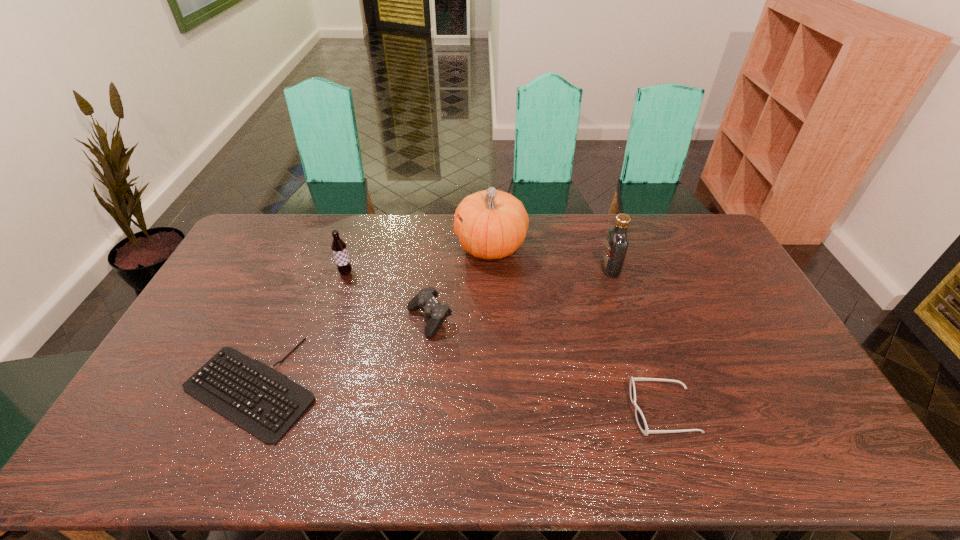
I want to click on free space located 0.270m on the front-facing side of the vodka, so click(525, 268).

Find the location of `vacant space situated 0.320m on the front-facing side of the vodka`. vacant space situated 0.320m on the front-facing side of the vodka is located at coordinates (512, 268).

This screenshot has height=540, width=960. I want to click on vacant region located on the left of the root beer, so click(307, 273).

Identify the location of free space located on the right of the fourth tallest object. This screenshot has height=540, width=960. (482, 320).

Where is `vacant space located 0.190m with the lenses of the sunglasses facing outward`? Image resolution: width=960 pixels, height=540 pixels. vacant space located 0.190m with the lenses of the sunglasses facing outward is located at coordinates (559, 411).

The height and width of the screenshot is (540, 960). Find the location of `vacant area situated with the lenses of the sunglasses facing outward`. vacant area situated with the lenses of the sunglasses facing outward is located at coordinates (483, 411).

Find the location of a particular element. This screenshot has height=540, width=960. free space located 0.080m with the lenses of the sunglasses facing outward is located at coordinates (601, 411).

Identify the location of blank space located 0.130m on the right of the shortest object. The height and width of the screenshot is (540, 960). (368, 387).

The width and height of the screenshot is (960, 540). I want to click on object that is at the far edge, so click(495, 223).

The width and height of the screenshot is (960, 540). I want to click on sunglasses that is at the near edge, so click(640, 418).